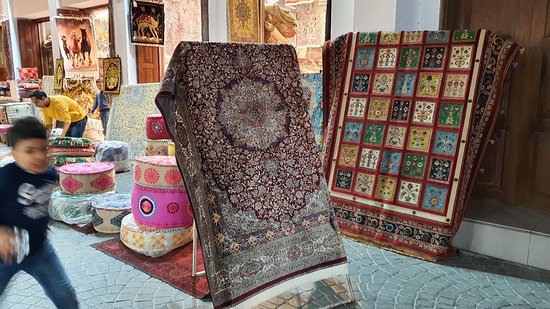
Identify the location of wood paneling. The width and height of the screenshot is (550, 309). (26, 50).